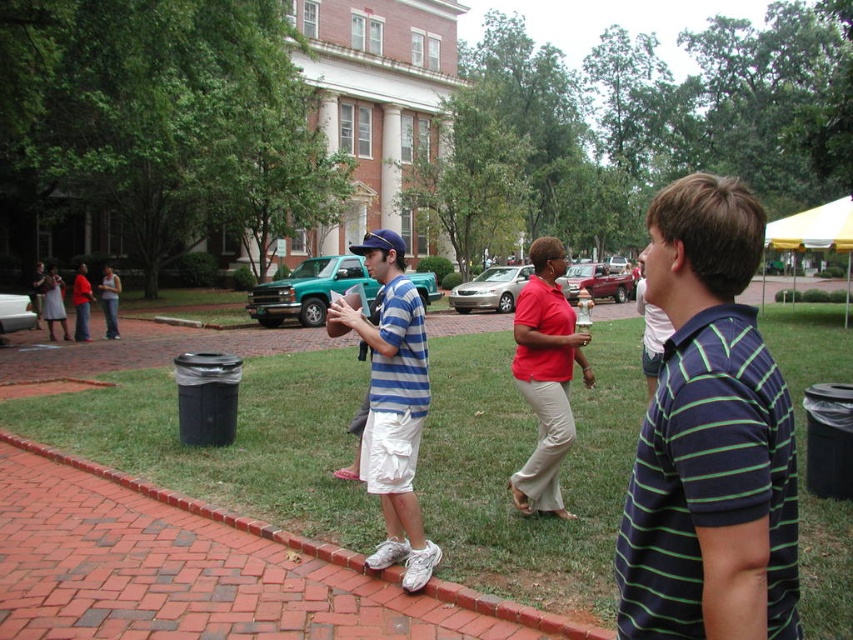
Question: Can you confirm if striped cotton shirt at center is positioned below matte red shirt at center?

Choices:
 (A) no
 (B) yes

Answer: (B)

Question: Which object is closer to the camera taking this photo?

Choices:
 (A) matte red shirt at center
 (B) striped cotton shirt at center

Answer: (B)

Question: Which is nearer to the matte red shirt at center?

Choices:
 (A) green grass at center
 (B) dark blue striped polo shirt at center
 (C) striped cotton shirt at center

Answer: (C)

Question: Does dark blue striped polo shirt at center appear under matte red shirt at center?

Choices:
 (A) yes
 (B) no

Answer: (A)

Question: Does striped cotton shirt at center appear under striped polo shirt at center?

Choices:
 (A) no
 (B) yes

Answer: (B)

Question: Which point is closer to the camera taking this photo?

Choices:
 (A) (639, 289)
 (B) (677, 513)
 (C) (428, 572)

Answer: (B)